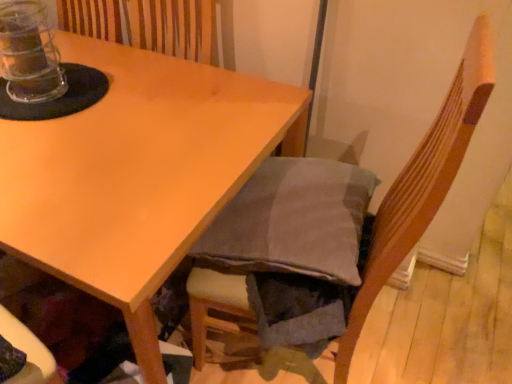
Question: From a real-world perspective, is transparent plastic jar at top left positioned above or below dark gray fabric chair at lower right?

Choices:
 (A) below
 (B) above

Answer: (B)

Question: Looking at their shapes, would you say transparent plastic jar at top left is wider or thinner than dark gray fabric chair at lower right?

Choices:
 (A) wide
 (B) thin

Answer: (B)

Question: Estimate the real-world distances between objects in this image. Which object is farther from the matte wood table at upper left?

Choices:
 (A) transparent plastic jar at top left
 (B) dark gray fabric chair at lower right

Answer: (B)

Question: Which is nearer to the dark gray fabric chair at lower right?

Choices:
 (A) matte wood table at upper left
 (B) transparent plastic jar at top left

Answer: (A)